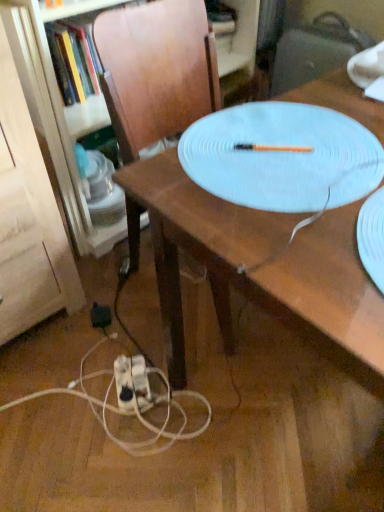
Identify the location of vacant space to the right of black plastic electric outlet at lower left. (139, 323).